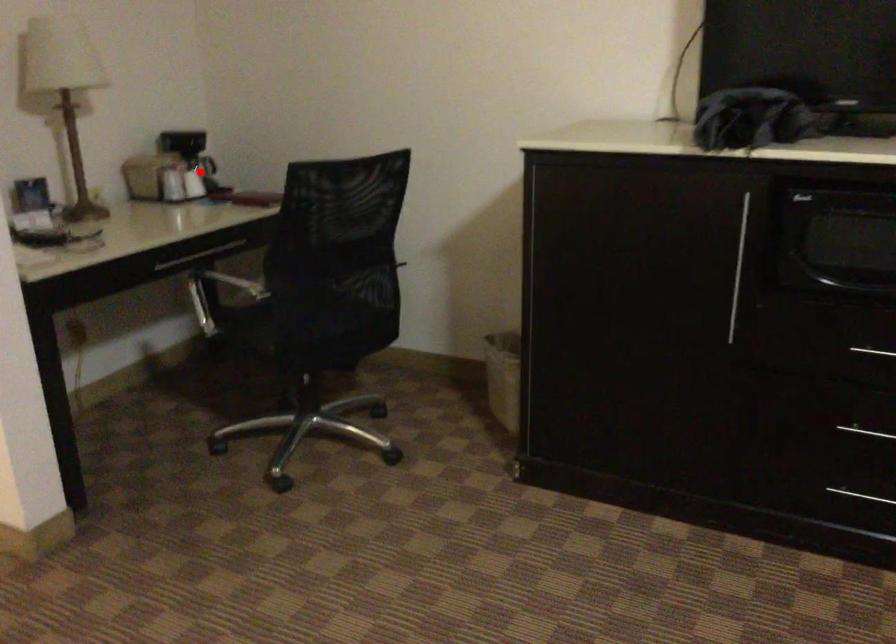
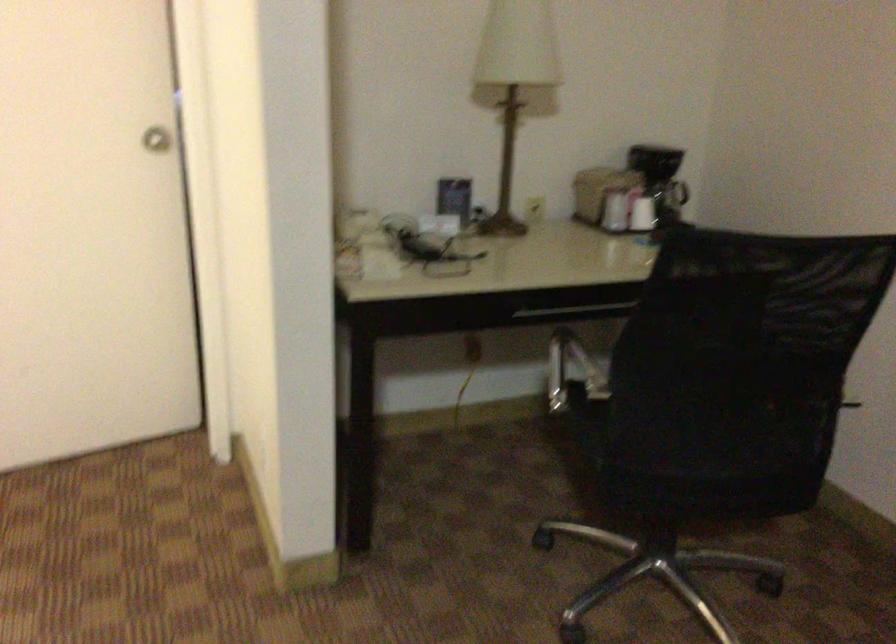
Question: I am providing you with two images of the same scene from different viewpoints. In image1, a red point is highlighted. Considering the same 3D point in image2, which of the following is correct?

Choices:
 (A) It is closer
 (B) It is farther

Answer: (A)